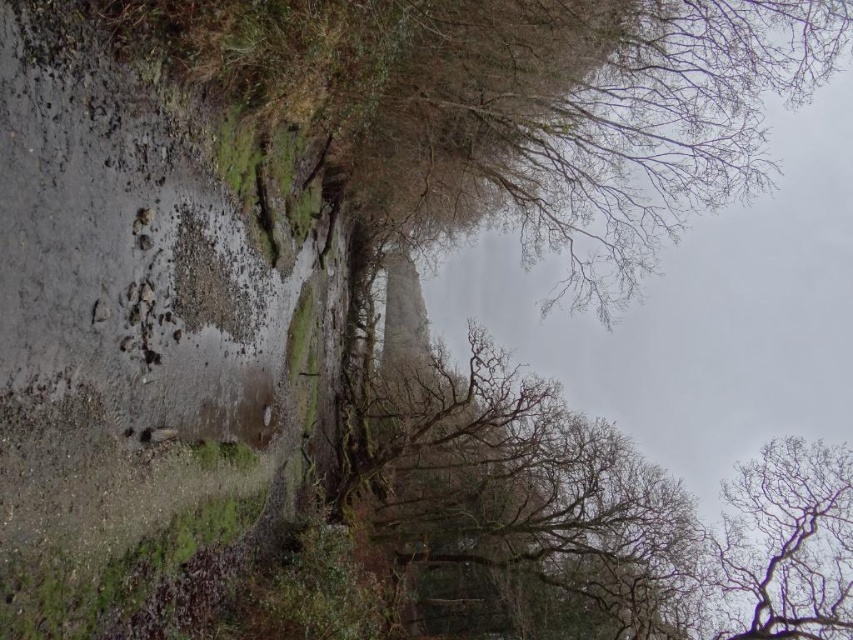
Can you confirm if damp soil at lower left is shorter than smooth bark tree at center?

Indeed, damp soil at lower left has a lesser height compared to smooth bark tree at center.

Is damp soil at lower left to the left of smooth bark tree at center from the viewer's perspective?

Indeed, damp soil at lower left is positioned on the left side of smooth bark tree at center.

This screenshot has height=640, width=853. What do you see at coordinates (142, 326) in the screenshot?
I see `damp soil at lower left` at bounding box center [142, 326].

I want to click on damp soil at lower left, so click(x=142, y=326).

Can you confirm if bare branches at left is wider than bare branches at upper right?

Correct, the width of bare branches at left exceeds that of bare branches at upper right.

Locate an element on the screen. The width and height of the screenshot is (853, 640). bare branches at left is located at coordinates (515, 106).

Which is behind, point (294, 125) or point (750, 580)?

The point (750, 580) is more distant.

At what (x,y) coordinates should I click in order to perform the action: click on bare branches at left. Please return your answer as a coordinate pair (x, y). Looking at the image, I should click on (515, 106).

In the scene shown: Is smooth bark tree at center closer to the viewer compared to bare branches at upper right?

That is True.

Is point (637, 579) closer to camera compared to point (737, 509)?

Yes, point (637, 579) is in front of point (737, 509).

At what (x,y) coordinates should I click in order to perform the action: click on smooth bark tree at center. Please return your answer as a coordinate pair (x, y). Image resolution: width=853 pixels, height=640 pixels. Looking at the image, I should click on tap(519, 508).